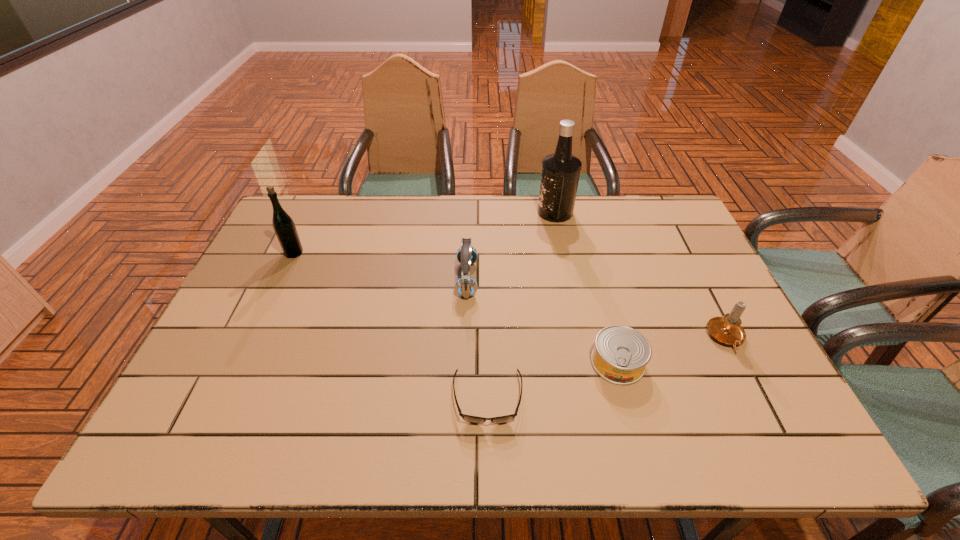
The height and width of the screenshot is (540, 960). I want to click on blank space at the far edge of the desktop, so click(442, 207).

Locate an element on the screen. vacant space at the near edge of the desktop is located at coordinates [x=455, y=450].

Locate an element on the screen. The width and height of the screenshot is (960, 540). free space at the left edge of the desktop is located at coordinates (278, 295).

Where is `vacant space at the right edge of the desktop`? vacant space at the right edge of the desktop is located at coordinates 737,350.

Find the location of a particular element. The image size is (960, 540). vacant space at the far left corner is located at coordinates [x=314, y=208].

This screenshot has height=540, width=960. In the image, there is a desktop. In order to click on vacant space at the far right corner in this screenshot , I will do `click(673, 226)`.

Image resolution: width=960 pixels, height=540 pixels. Find the location of `free space between the second shortest object and the headset`. free space between the second shortest object and the headset is located at coordinates (542, 321).

Where is `free spot between the farthest object and the leftmost object`? The height and width of the screenshot is (540, 960). free spot between the farthest object and the leftmost object is located at coordinates (424, 233).

Identify the location of vacant point located between the farthest object and the candle. This screenshot has width=960, height=540. click(640, 275).

The height and width of the screenshot is (540, 960). In order to click on blank region between the rightmost object and the fifth shortest object in this screenshot , I will do `click(510, 295)`.